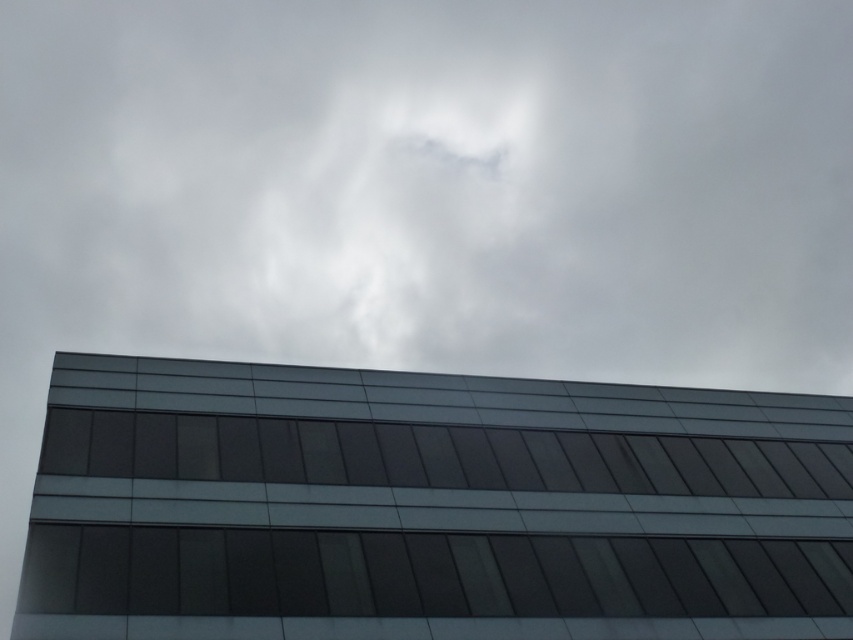
This screenshot has height=640, width=853. What do you see at coordinates (431, 188) in the screenshot?
I see `white fluffy cloud at upper center` at bounding box center [431, 188].

Can you confirm if white fluffy cloud at upper center is shorter than transparent glass window at bottom?

Incorrect, white fluffy cloud at upper center's height does not fall short of transparent glass window at bottom's.

Locate an element on the screen. Image resolution: width=853 pixels, height=640 pixels. white fluffy cloud at upper center is located at coordinates (431, 188).

Does transparent glass window at bottom lie behind dark glass window at center?

No, transparent glass window at bottom is in front of dark glass window at center.

Does point (114, 561) come closer to viewer compared to point (99, 465)?

Yes, point (114, 561) is in front of point (99, 465).

The width and height of the screenshot is (853, 640). Identify the location of transparent glass window at bottom. (425, 573).

Image resolution: width=853 pixels, height=640 pixels. What do you see at coordinates (431, 188) in the screenshot?
I see `white fluffy cloud at upper center` at bounding box center [431, 188].

Which of these two, white fluffy cloud at upper center or dark glass window at center, stands taller?

Standing taller between the two is white fluffy cloud at upper center.

What do you see at coordinates (431, 188) in the screenshot? Image resolution: width=853 pixels, height=640 pixels. I see `white fluffy cloud at upper center` at bounding box center [431, 188].

Identify the location of white fluffy cloud at upper center. (431, 188).